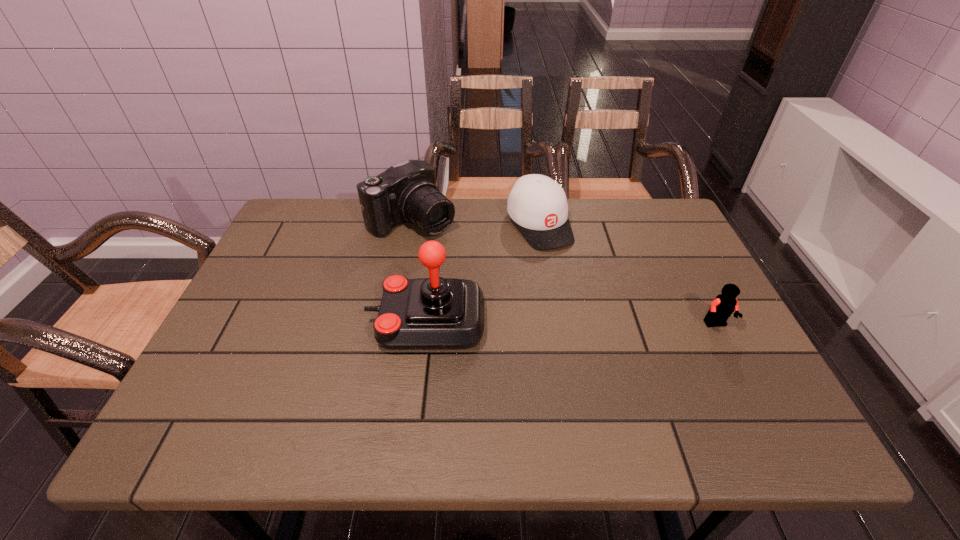
I want to click on joystick, so coord(432,313).

The height and width of the screenshot is (540, 960). In order to click on Lego in this screenshot , I will do `click(721, 308)`.

You are a GUI agent. You are given a task and a screenshot of the screen. Output one action in this format:
    pyautogui.click(x=<x>, y=<y>)
    Task: Click on the baseball cap
    The width and height of the screenshot is (960, 540).
    Given the screenshot: What is the action you would take?
    pyautogui.click(x=538, y=205)

Where is `the third shortest object`? the third shortest object is located at coordinates (406, 192).

This screenshot has width=960, height=540. I want to click on vacant space located 0.060m on the base of the tallest object, so click(343, 321).

Locate an element on the screen. free region located 0.260m on the base of the tallest object is located at coordinates (258, 321).

This screenshot has width=960, height=540. What are the coordinates of `vacant space situated on the base of the tallest object` in the screenshot? It's located at (292, 321).

Where is `free space located 0.160m on the front-facing side of the rightmost object`? free space located 0.160m on the front-facing side of the rightmost object is located at coordinates (752, 393).

Identify the location of free space located 0.280m on the front-facing side of the baseball cap. (604, 322).

Locate an element on the screen. free location located 0.370m on the front-facing side of the baseball cap is located at coordinates (624, 352).